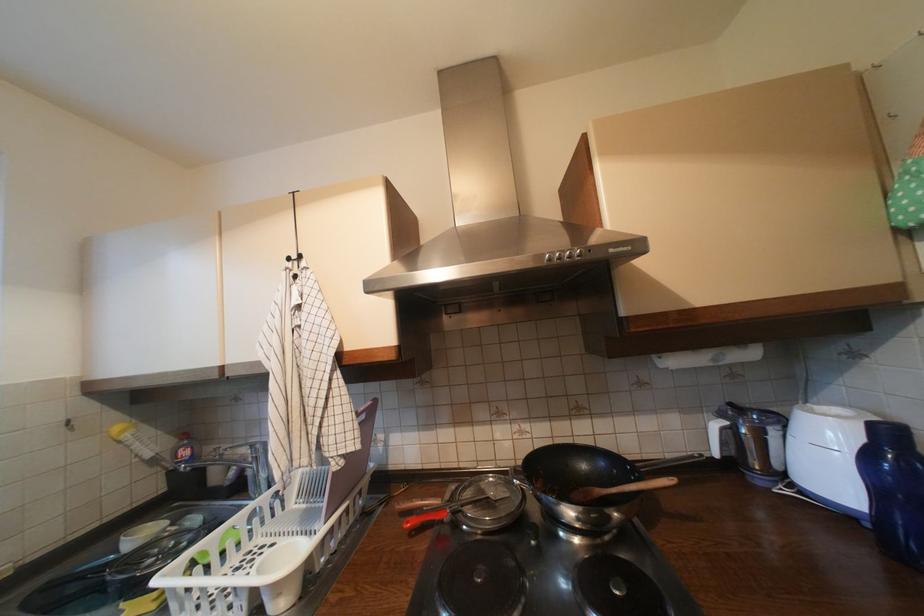
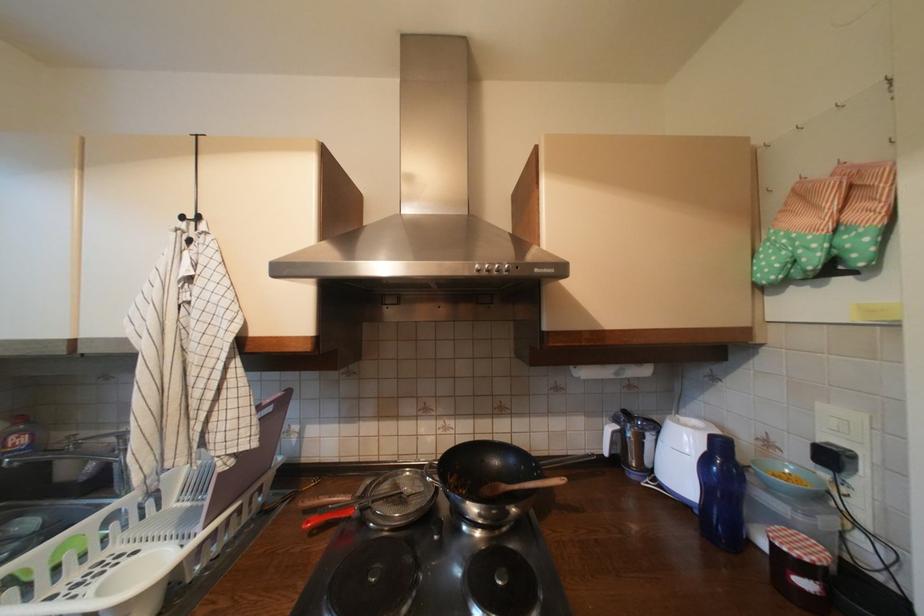
Locate, in the second image, the point that corresponds to the point at 496,499 in the first image.

(410, 495)